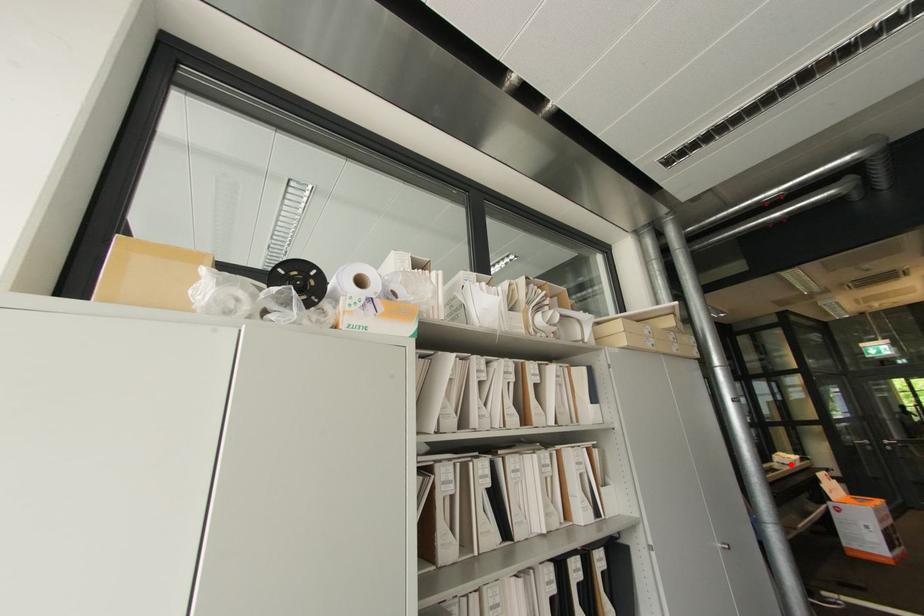
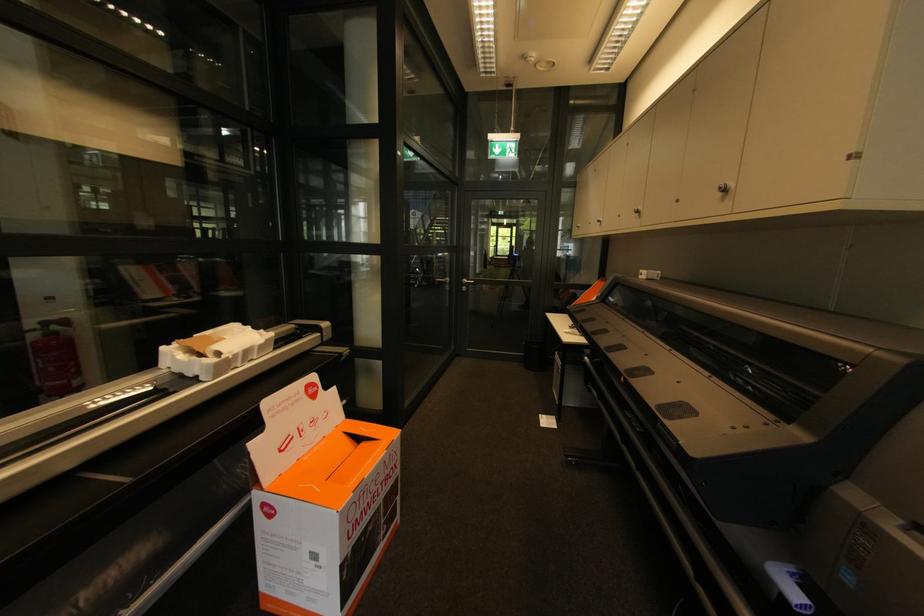
Locate, in the second image, the point that corresponds to the highlighted location in the first image.

(195, 376)